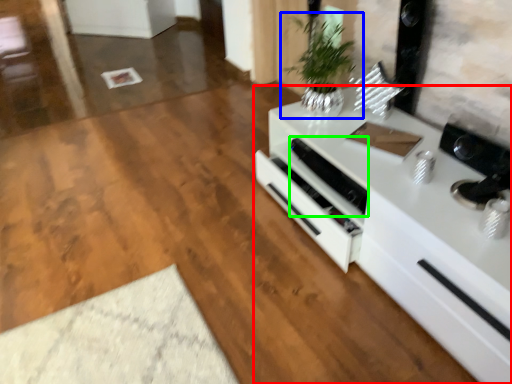
Question: Based on their relative distances, which object is farther from countertop (highlighted by a red box)? Choose from houseplant (highlighted by a blue box) and appliance (highlighted by a green box).

Choices:
 (A) houseplant
 (B) appliance

Answer: (A)